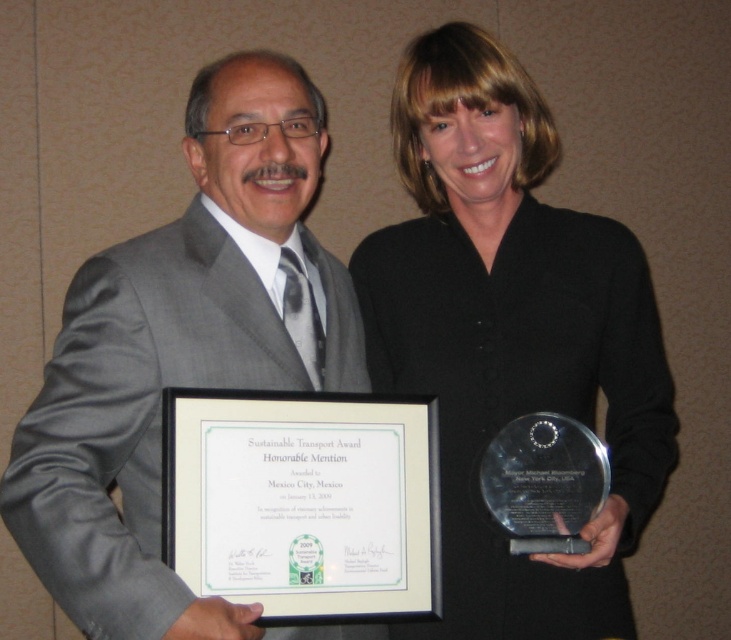
You are a photographer setting up for a group photo. You notice the black matte award at center and the gray suit at center. Which object is wider?

The black matte award at center is wider than the gray suit at center.

You are organizing a gallery exhibition and need to place the black matte award at center and the gray suit at center on a shelf. Given their sizes, which object should be placed first to ensure both fit properly?

The black matte award at center is smaller than the gray suit at center, so you should place the gray suit at center first to ensure both fit properly.

You are a photographer preparing to take a group photo of the two people in the scene. You want to ensure both the black matte award at center and the gray suit at center are clearly visible in the photo. Given their height difference, where should you position the camera to capture both objects without cropping either?

The black matte award at center is much taller than the gray suit at center. To capture both without cropping, position the camera at a lower angle so that the award is fully visible while still including the gray suit at center in the frame.